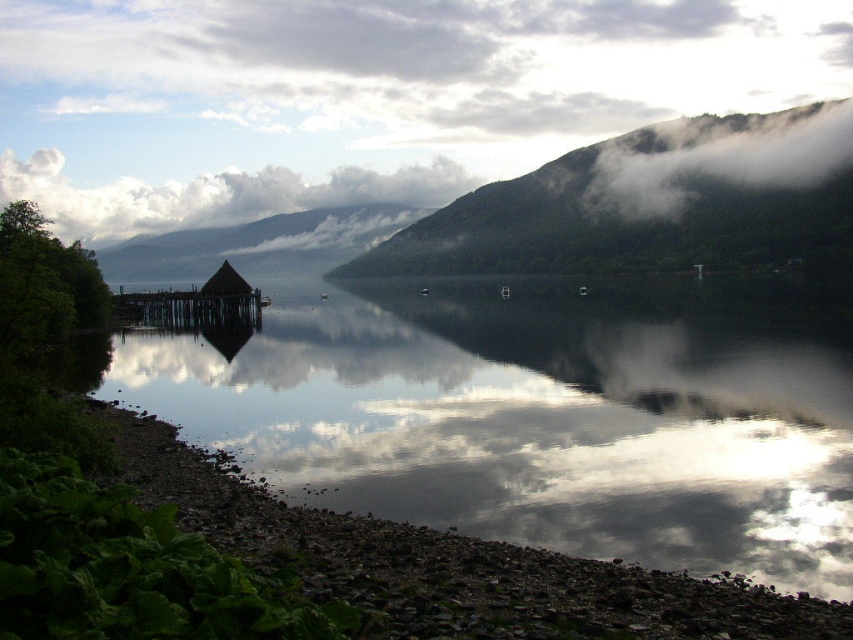
Can you confirm if white fluffy cloud at upper center is thinner than brown wooden dock at left?

No.

Can you confirm if white fluffy cloud at upper center is shorter than brown wooden dock at left?

Incorrect, white fluffy cloud at upper center's height does not fall short of brown wooden dock at left's.

Does point (136, 186) lie in front of point (241, 280)?

No.

The image size is (853, 640). In order to click on white fluffy cloud at upper center in this screenshot , I will do `click(213, 195)`.

The width and height of the screenshot is (853, 640). Identify the location of green forested mountain at upper center. (651, 204).

Between point (541, 182) and point (10, 163), which one is positioned behind?

The point (10, 163) is more distant.

What do you see at coordinates (651, 204) in the screenshot? The height and width of the screenshot is (640, 853). I see `green forested mountain at upper center` at bounding box center [651, 204].

The width and height of the screenshot is (853, 640). I want to click on green forested mountain at upper center, so point(651,204).

Between smooth pebbles at lower left and green forested mountain at upper center, which one appears on the right side from the viewer's perspective?

green forested mountain at upper center

What do you see at coordinates (451, 564) in the screenshot?
I see `smooth pebbles at lower left` at bounding box center [451, 564].

Image resolution: width=853 pixels, height=640 pixels. I want to click on smooth pebbles at lower left, so click(x=451, y=564).